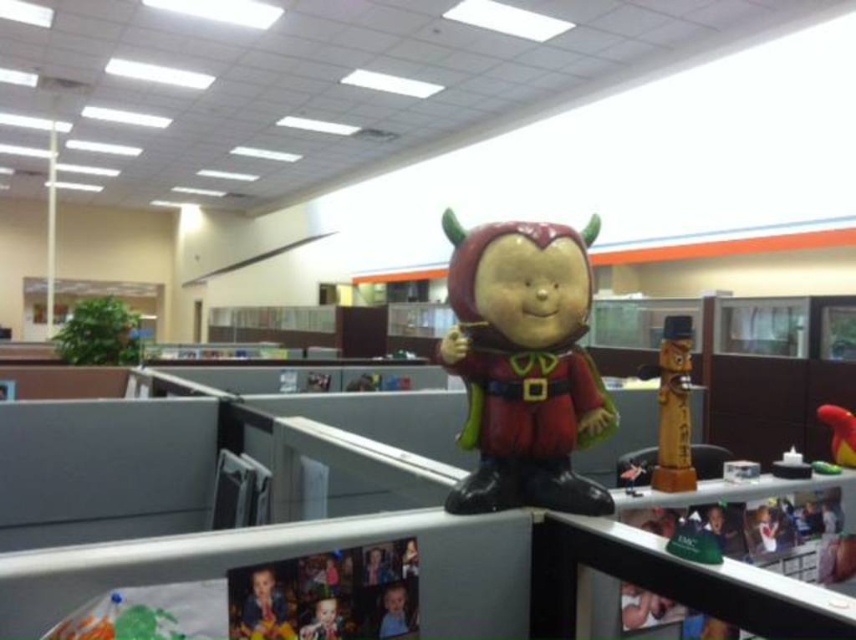
Question: Can you confirm if wooden statue at right is wider than rubber duck at upper center?

Choices:
 (A) no
 (B) yes

Answer: (B)

Question: Which of the following is the farthest from the observer?

Choices:
 (A) (474, 406)
 (B) (669, 390)
 (C) (852, 433)

Answer: (C)

Question: Which point is farther to the camera?

Choices:
 (A) (501, 365)
 (B) (654, 468)
 (C) (843, 451)

Answer: (C)

Question: Which of the following is the farthest from the observer?

Choices:
 (A) wooden statue at right
 (B) matte plastic toy at center
 (C) rubber duck at upper center

Answer: (C)

Question: Can you confirm if matte plastic toy at center is positioned above wooden statue at right?

Choices:
 (A) no
 (B) yes

Answer: (B)

Question: Is wooden statue at right to the left of rubber duck at upper center from the viewer's perspective?

Choices:
 (A) no
 (B) yes

Answer: (B)